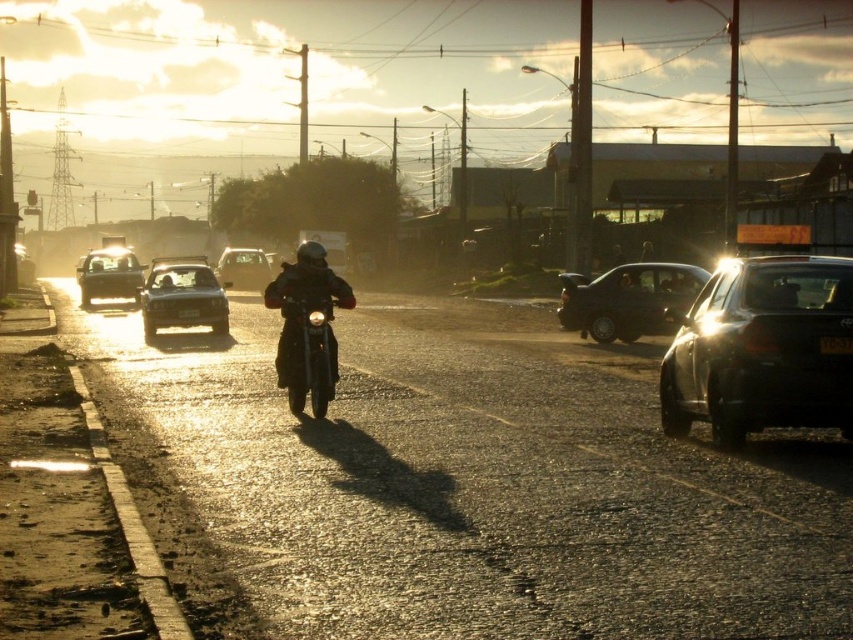
You are a pedestrian standing on the sidewalk and see the satin black sedan at right and the shiny black sedan at center. Which one is closer to the road edge?

The satin black sedan at right is closer to the road edge because it is positioned to the right of the shiny black sedan at center, which is in the center of the road.

You are a pedestrian standing on the sidewalk and see the satin black sedan at right and the shiny silver sedan at left. Which sedan is closer to the ground?

The satin black sedan at right is closer to the ground because it is positioned below the shiny silver sedan at left.

Looking at this image, you are a delivery person who needs to park your vehicle between the satin black sedan at right and the shiny silver sedan at left. Can you fit a standard delivery van that is 2.5 meters wide in the space between them?

The satin black sedan at right is narrower than the shiny silver sedan at left, but the exact distance between them isn not provided. Without knowing the total space available, it is impossible to determine if the 2.5 meter wide delivery van can fit between them.